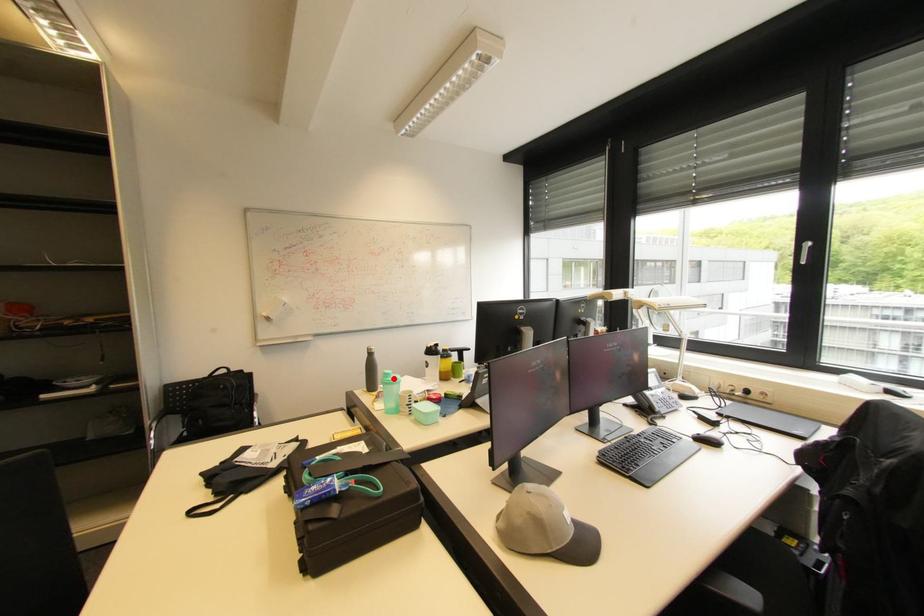
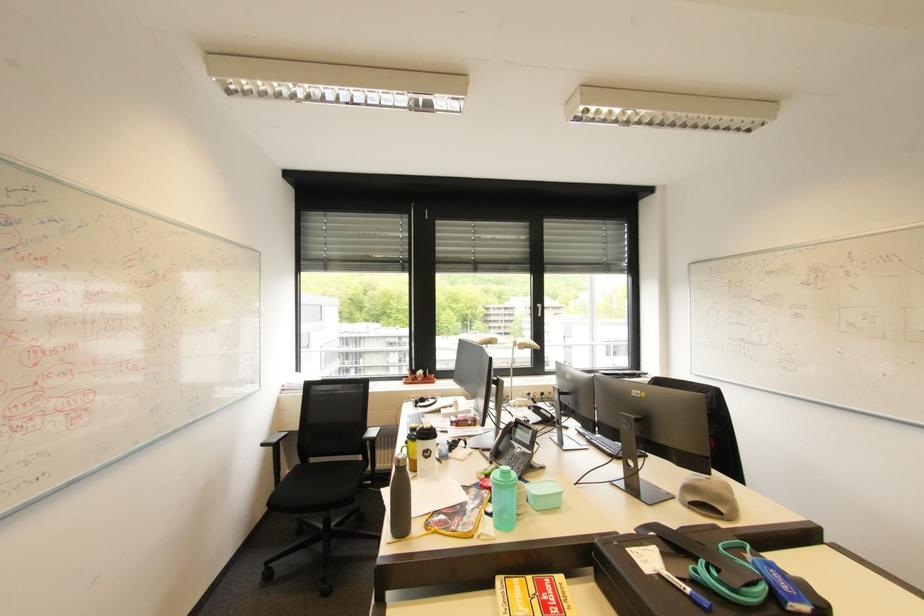
The point at the highlighted location is marked in the first image. Where is the corresponding point in the second image?

(517, 477)